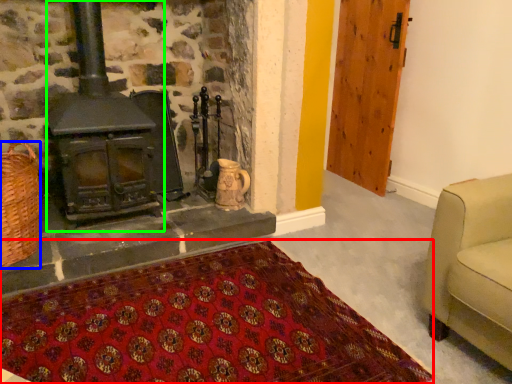
Question: Which object is the closest to the mat (highlighted by a red box)? Choose among these: basket (highlighted by a blue box) or wood burning stove (highlighted by a green box).

Choices:
 (A) basket
 (B) wood burning stove

Answer: (A)